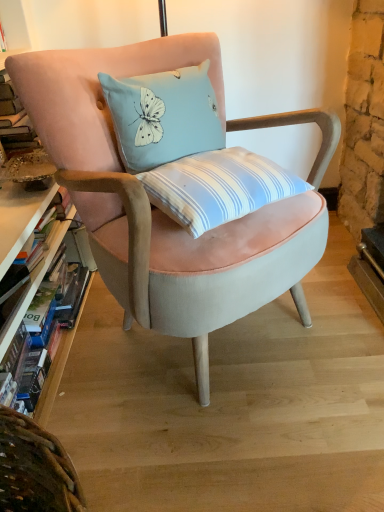
At what (x,y) coordinates should I click in order to perform the action: click on free location in front of velvet pink chair at center. Please return your answer as a coordinate pair (x, y). The image size is (384, 512). Looking at the image, I should click on (x=228, y=441).